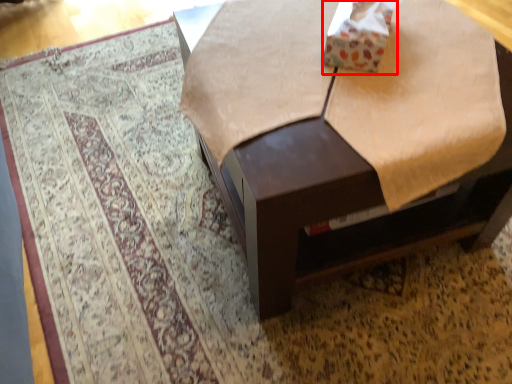
Question: Where is cardboard box (annotated by the red box) located in relation to table in the image?

Choices:
 (A) right
 (B) left

Answer: (A)